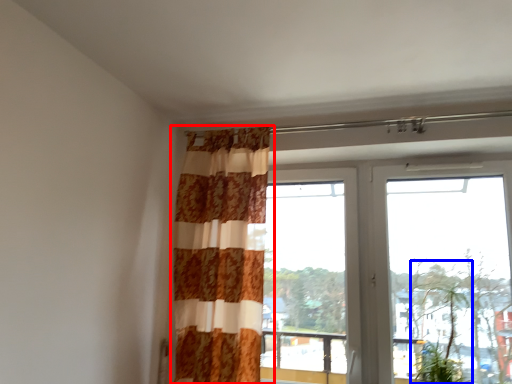
Question: Which point is closer to the camera, curtain (highlighted by a red box) or plant (highlighted by a blue box)?

Choices:
 (A) curtain
 (B) plant

Answer: (B)